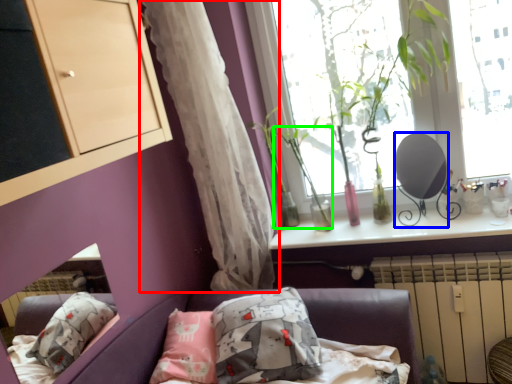
Question: Estimate the real-world distances between objects in this image. Which object is farther from curtain (highlighted by a red box), mirror (highlighted by a blue box) or plant (highlighted by a green box)?

Choices:
 (A) mirror
 (B) plant

Answer: (A)